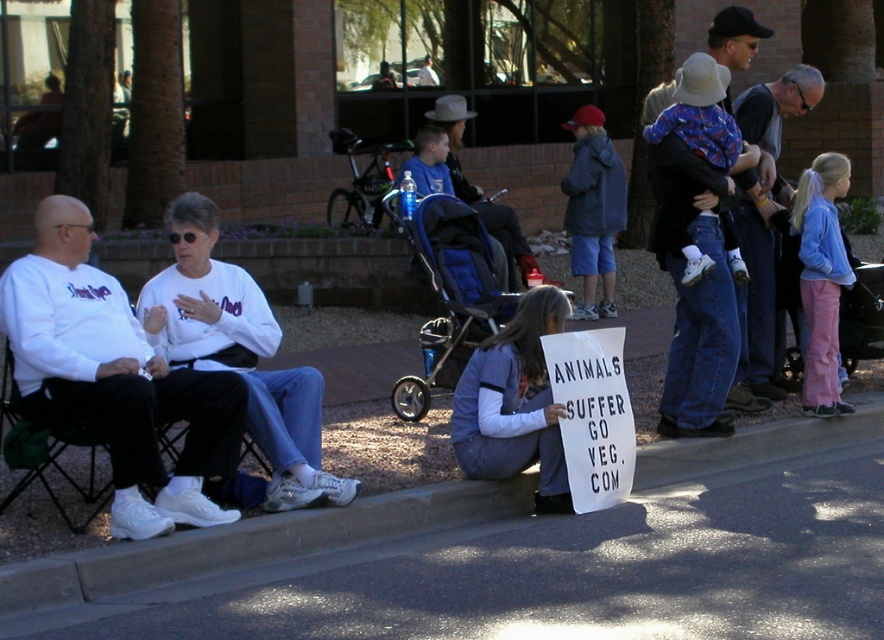
Question: Which of the following is the farthest from the observer?

Choices:
 (A) (776, 128)
 (B) (229, 388)
 (C) (509, 365)
 (D) (696, 630)

Answer: (A)

Question: Does blue fabric stroller at center have a lesser width compared to gray knit sweater at upper right?

Choices:
 (A) yes
 (B) no

Answer: (B)

Question: Among these objects, which one is farthest from the camera?

Choices:
 (A) blue fabric stroller at center
 (B) white matte shirt at left

Answer: (A)

Question: Does denim jacket at lower center have a larger size compared to blue denim jacket at center?

Choices:
 (A) yes
 (B) no

Answer: (B)

Question: Does gray asphalt pavement at lower center have a greater width compared to white matte shirt at left?

Choices:
 (A) yes
 (B) no

Answer: (A)

Question: Which object is positioned farthest from the denim jeans at center?

Choices:
 (A) gray asphalt pavement at lower center
 (B) black fabric chair at left
 (C) blue denim jacket at center
 (D) gray knit sweater at upper right

Answer: (C)